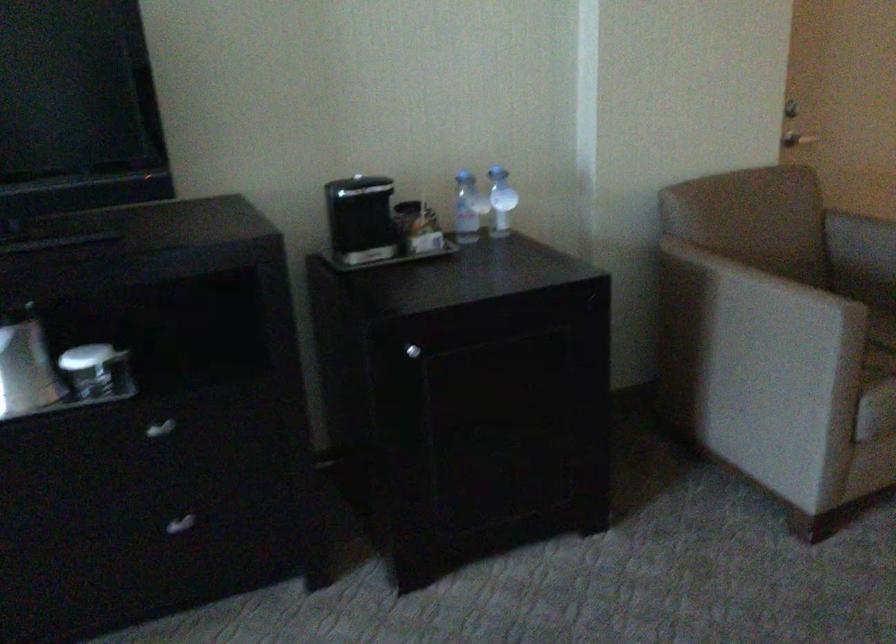
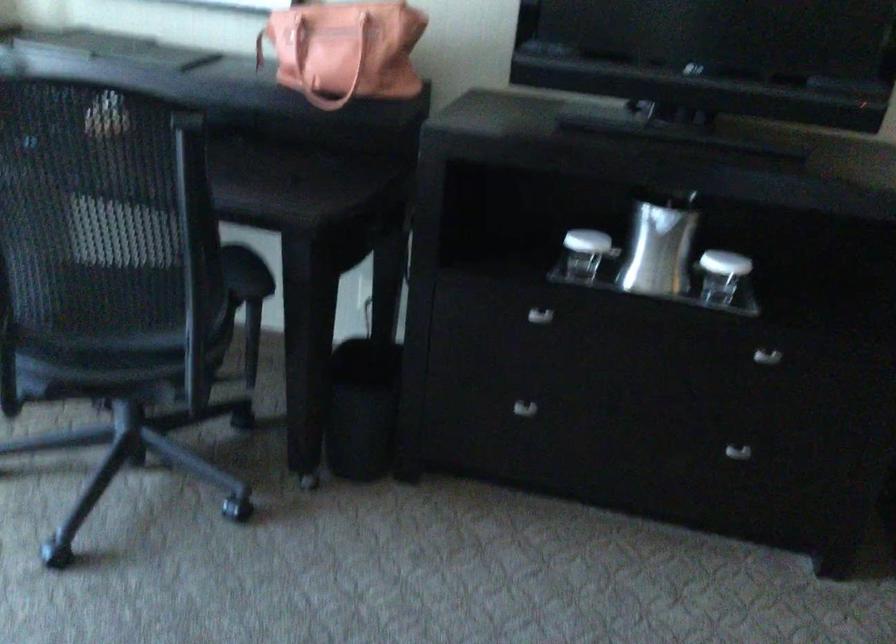
The point at (183, 524) is marked in the first image. Where is the corresponding point in the second image?

(737, 451)